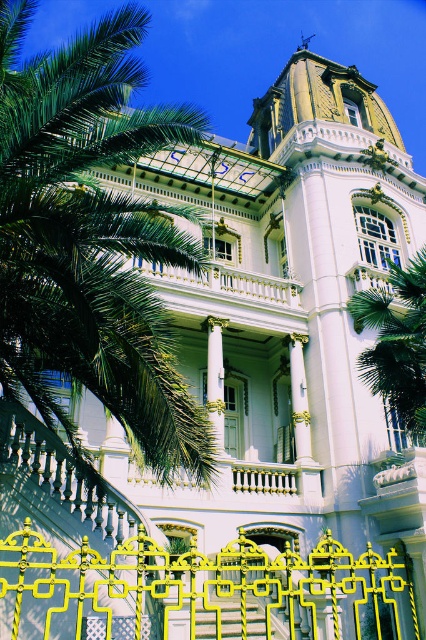
Question: Does green leafy palm tree at left come behind green leafy palm tree at center?

Choices:
 (A) no
 (B) yes

Answer: (A)

Question: Can you confirm if green leafy palm tree at left is thinner than green leafy palm tree at center?

Choices:
 (A) no
 (B) yes

Answer: (A)

Question: Considering the relative positions of green leafy palm tree at left and green leafy palm tree at center in the image provided, where is green leafy palm tree at left located with respect to green leafy palm tree at center?

Choices:
 (A) above
 (B) below

Answer: (A)

Question: Which point is farther to the camera?

Choices:
 (A) (397, 291)
 (B) (31, 131)

Answer: (A)

Question: Estimate the real-world distances between objects in this image. Which object is farther from the green leafy palm tree at left?

Choices:
 (A) white marble column at center
 (B) green leafy palm tree at center
 (C) yellow metallic stairs at center

Answer: (B)

Question: Which point appears closest to the camera in this image?

Choices:
 (A) (255, 630)
 (B) (115, 250)

Answer: (B)